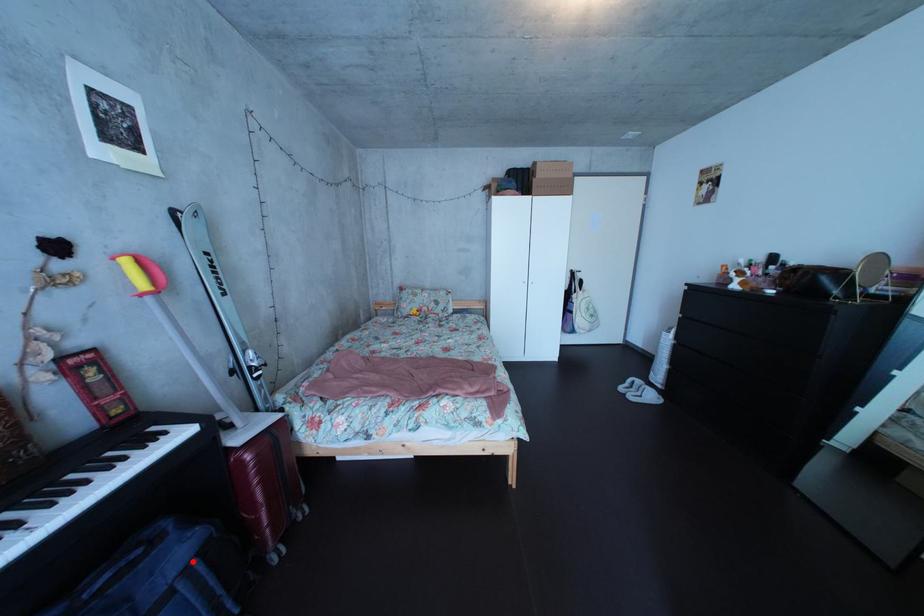
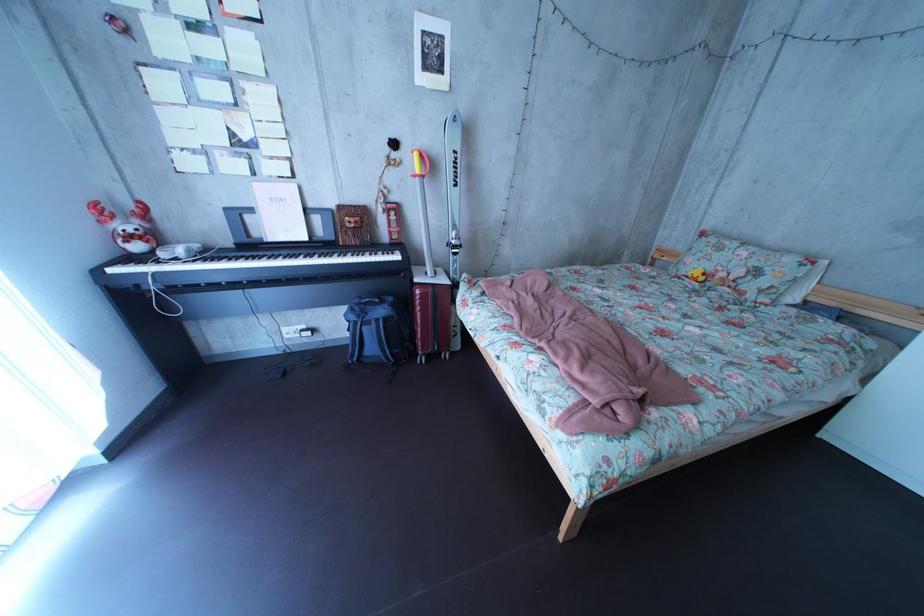
Question: I am providing you with two images of the same scene from different viewpoints. A red point is marked on the first image. At the location where the point appears in image 1, is it still visible in image 2?

Choices:
 (A) Yes
 (B) No

Answer: (A)